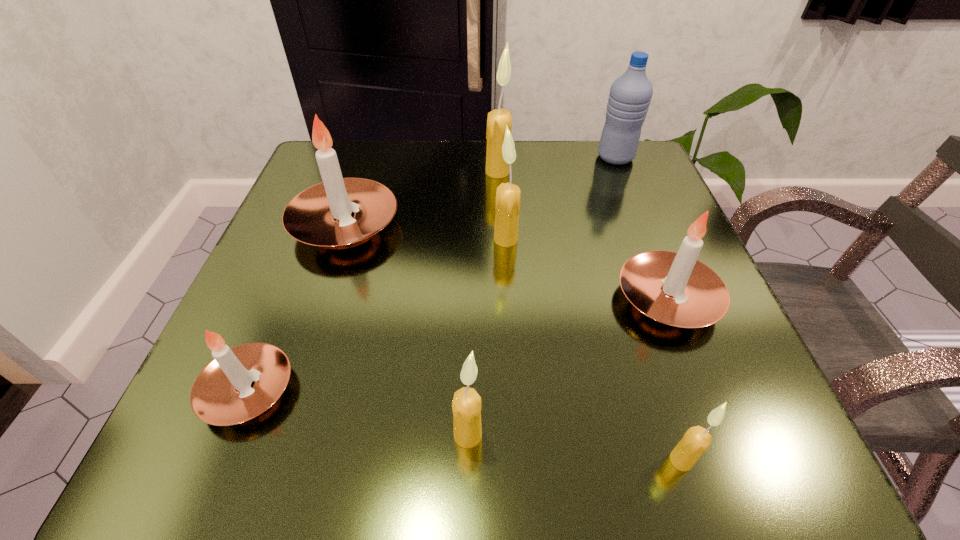
Find the location of `vacant space that's between the smallest white candle and the biggest cream candle`. vacant space that's between the smallest white candle and the biggest cream candle is located at coordinates coord(372,281).

Identify the location of free area in between the third biggest cream candle and the second biggest cream candle. (487, 337).

Find the location of a particular element. the fourth closest object to the smallest white candle is located at coordinates (674, 288).

I want to click on object that is the second nearest to the blue water bottle, so click(x=507, y=206).

Where is `the second closest candle to the smallest white candle`? The width and height of the screenshot is (960, 540). the second closest candle to the smallest white candle is located at coordinates (466, 406).

You are a GUI agent. You are given a task and a screenshot of the screen. Output one action in this format:
    pyautogui.click(x=<x>, y=<y>)
    Task: Click on the candle that is the fifth nearest to the nearest cream candle
    Image resolution: width=960 pixels, height=540 pixels.
    Given the screenshot: What is the action you would take?
    pyautogui.click(x=320, y=215)

Locate which cream candle is the third closest to the farthest white candle. Please provide its 2D coordinates. Your answer should be formatted as a tuple, i.e. [(x, y)], where the tuple contains the x and y coordinates of a point satisfying the conditions above.

[(466, 406)]

Identify the location of cream candle identified as the third closest to the farthest cream candle. (696, 440).

Locate which white candle is the second closest to the smallest white candle. Please provide its 2D coordinates. Your answer should be formatted as a tuple, i.e. [(x, y)], where the tuple contains the x and y coordinates of a point satisfying the conditions above.

[(674, 288)]

At what (x,y) coordinates should I click in order to perform the action: click on white candle that is the second closest to the water bottle. Please return your answer as a coordinate pair (x, y). The image size is (960, 540). Looking at the image, I should click on (320, 215).